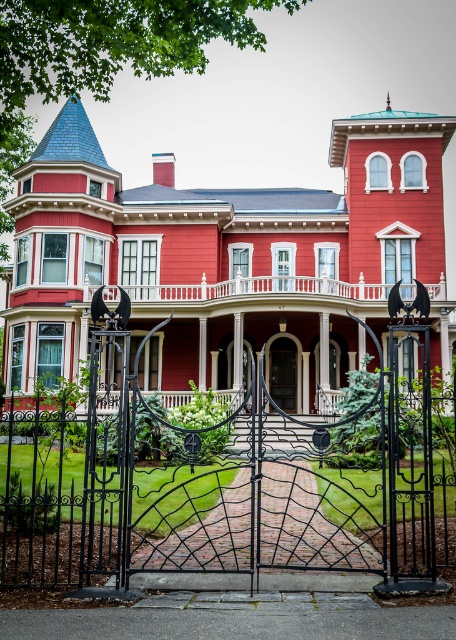
Question: Can you confirm if black wrought iron gate at center is wider than smooth wood door at center?

Choices:
 (A) no
 (B) yes

Answer: (B)

Question: Which point is farther from the camera taking this photo?

Choices:
 (A) click(71, 560)
 (B) click(284, 339)

Answer: (B)

Question: Which of these objects is positioned closest to the smooth red porch at center?

Choices:
 (A) smooth wood door at center
 (B) black wrought iron gate at center

Answer: (A)

Question: Is smooth red porch at center closer to camera compared to smooth wood door at center?

Choices:
 (A) no
 (B) yes

Answer: (B)

Question: Which of the following is the closest to the observer?

Choices:
 (A) (201, 292)
 (B) (270, 376)

Answer: (A)

Question: Can you confirm if smooth red porch at center is positioned above smooth wood door at center?

Choices:
 (A) no
 (B) yes

Answer: (B)